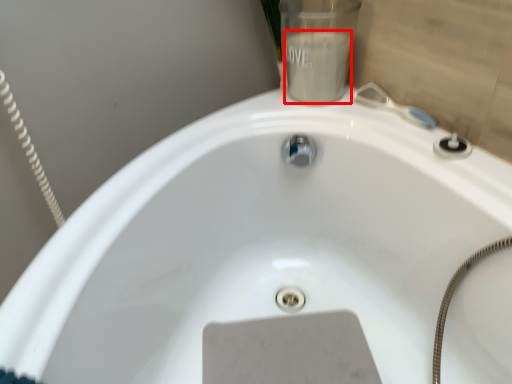
Question: Where is liquid (annotated by the red box) located in relation to plumbing fixture in the image?

Choices:
 (A) left
 (B) right

Answer: (A)